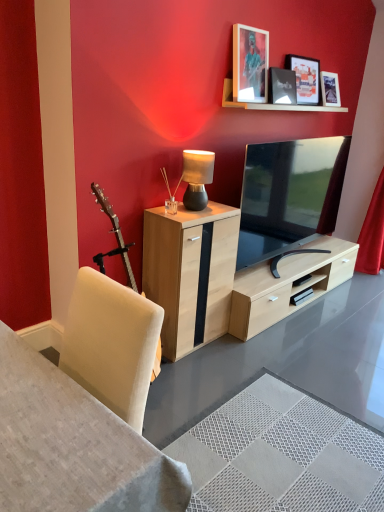
Question: Can you confirm if matte black table lamp at center is bigger than matte black tv at center?

Choices:
 (A) yes
 (B) no

Answer: (B)

Question: Can you confirm if matte black table lamp at center is taller than matte black tv at center?

Choices:
 (A) no
 (B) yes

Answer: (A)

Question: Is matte black table lamp at center oriented towards matte black tv at center?

Choices:
 (A) yes
 (B) no

Answer: (B)

Question: Is matte black table lamp at center positioned beyond the bounds of matte black tv at center?

Choices:
 (A) yes
 (B) no

Answer: (A)

Question: Is matte black table lamp at center positioned far away from matte black tv at center?

Choices:
 (A) yes
 (B) no

Answer: (B)

Question: Considering the positions of wooden shelf at upper center and light wood cabinet at center in the image, is wooden shelf at upper center taller or shorter than light wood cabinet at center?

Choices:
 (A) tall
 (B) short

Answer: (B)

Question: Is wooden shelf at upper center to the left or to the right of light wood cabinet at center in the image?

Choices:
 (A) left
 (B) right

Answer: (B)

Question: Is wooden shelf at upper center wider or thinner than light wood cabinet at center?

Choices:
 (A) thin
 (B) wide

Answer: (A)

Question: Is wooden shelf at upper center inside or outside of light wood cabinet at center?

Choices:
 (A) inside
 (B) outside

Answer: (B)

Question: Considering the positions of wooden shelf at upper center and white fabric desk at lower left in the image, is wooden shelf at upper center bigger or smaller than white fabric desk at lower left?

Choices:
 (A) small
 (B) big

Answer: (A)

Question: Is wooden shelf at upper center taller or shorter than white fabric desk at lower left?

Choices:
 (A) short
 (B) tall

Answer: (A)

Question: Does point (231, 90) appear closer or farther from the camera than point (21, 441)?

Choices:
 (A) closer
 (B) farther

Answer: (B)

Question: From the image's perspective, is wooden shelf at upper center above or below white fabric desk at lower left?

Choices:
 (A) below
 (B) above

Answer: (B)

Question: Would you say white fabric desk at lower left is to the left or to the right of matte black picture frame at upper center, the second picture frame when ordered from right to left, in the picture?

Choices:
 (A) left
 (B) right

Answer: (A)

Question: Is white fabric desk at lower left in front of or behind matte black picture frame at upper center, the second picture frame when ordered from right to left, in the image?

Choices:
 (A) front
 (B) behind

Answer: (A)